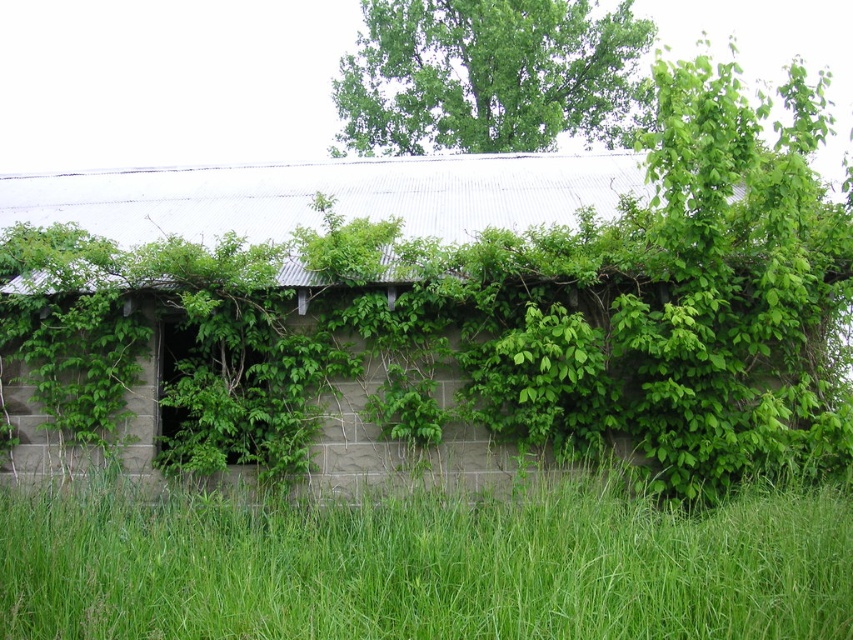
Can you confirm if green grass at lower center is bigger than green leafy tree at upper center?

No.

Is the position of green grass at lower center less distant than that of green leafy tree at upper center?

That is True.

Where is `green grass at lower center`? The image size is (853, 640). green grass at lower center is located at coordinates (427, 564).